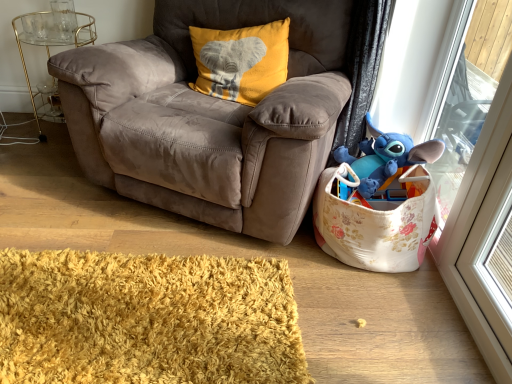
Question: Is suede brown armchair at center next to blue plush toy at right and touching it?

Choices:
 (A) no
 (B) yes

Answer: (A)

Question: From the image's perspective, would you say suede brown armchair at center is positioned over blue plush toy at right?

Choices:
 (A) no
 (B) yes

Answer: (B)

Question: Is suede brown armchair at center positioned beyond the bounds of blue plush toy at right?

Choices:
 (A) yes
 (B) no

Answer: (A)

Question: Is suede brown armchair at center closer to the viewer compared to blue plush toy at right?

Choices:
 (A) no
 (B) yes

Answer: (B)

Question: Considering the relative sizes of suede brown armchair at center and blue plush toy at right in the image provided, is suede brown armchair at center bigger than blue plush toy at right?

Choices:
 (A) no
 (B) yes

Answer: (B)

Question: Is suede brown armchair at center wider than blue plush toy at right?

Choices:
 (A) no
 (B) yes

Answer: (B)

Question: From a real-world perspective, is blue plush toy at upper right on top of yellow shaggy rug at lower left?

Choices:
 (A) no
 (B) yes

Answer: (B)

Question: Considering the relative sizes of blue plush toy at upper right and yellow shaggy rug at lower left in the image provided, is blue plush toy at upper right shorter than yellow shaggy rug at lower left?

Choices:
 (A) yes
 (B) no

Answer: (B)

Question: From a real-world perspective, is blue plush toy at upper right positioned under yellow shaggy rug at lower left based on gravity?

Choices:
 (A) yes
 (B) no

Answer: (B)

Question: Would you say blue plush toy at upper right is outside yellow shaggy rug at lower left?

Choices:
 (A) yes
 (B) no

Answer: (A)

Question: Are blue plush toy at upper right and yellow shaggy rug at lower left far apart?

Choices:
 (A) yes
 (B) no

Answer: (B)

Question: Considering the relative sizes of blue plush toy at upper right and yellow shaggy rug at lower left in the image provided, is blue plush toy at upper right taller than yellow shaggy rug at lower left?

Choices:
 (A) no
 (B) yes

Answer: (B)

Question: Can you confirm if floral fabric toy storage at lower right is positioned to the right of gold metallic side table at left?

Choices:
 (A) yes
 (B) no

Answer: (A)